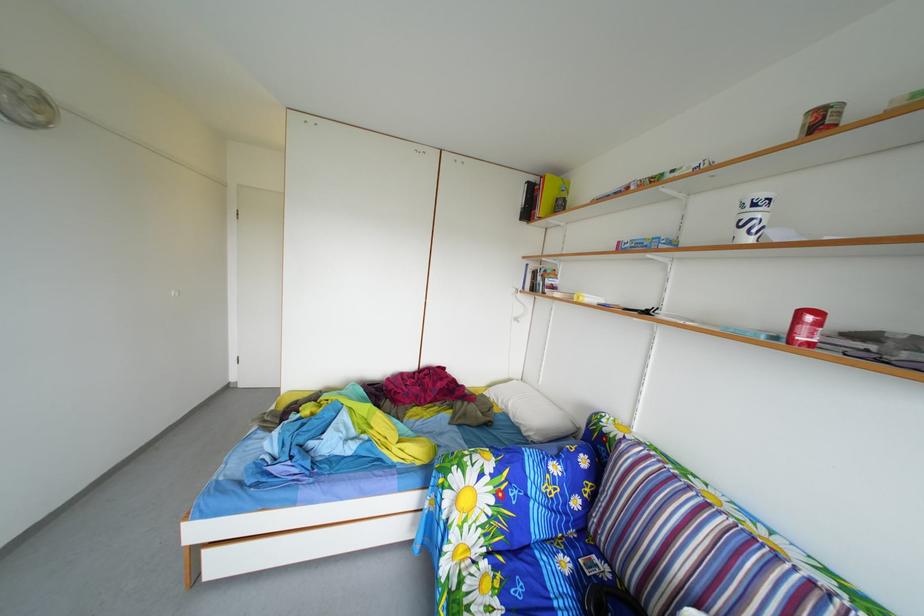
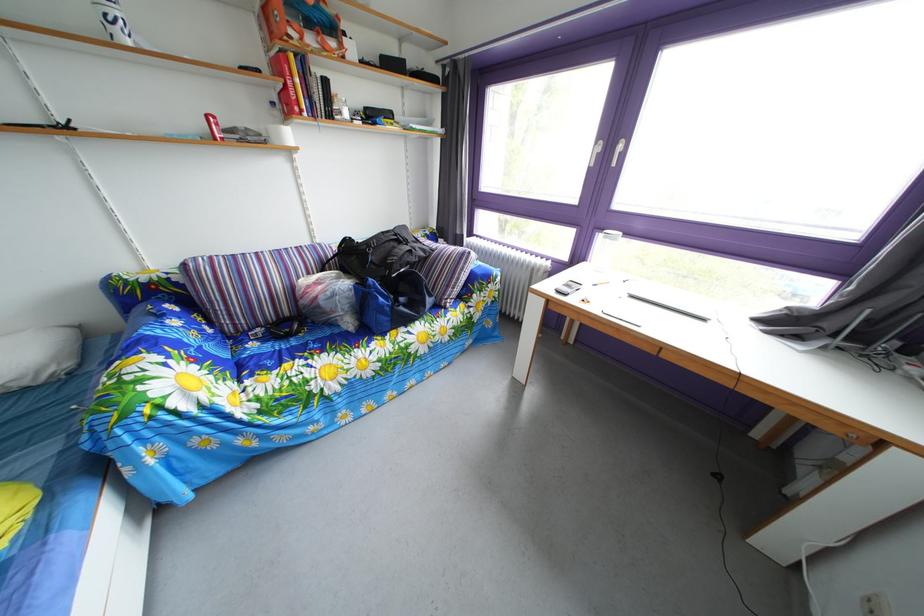
Find the pixel in the second image that matches point 576,570 in the first image.

(262, 353)